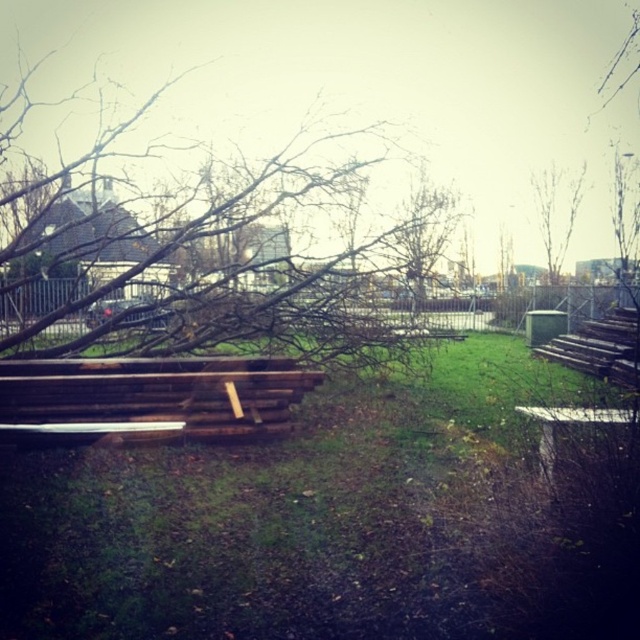
Question: Among these objects, which one is farthest from the camera?

Choices:
 (A) brown wooden bench at center
 (B) white wood park bench at lower right
 (C) brown wood tree at center

Answer: (C)

Question: Estimate the real-world distances between objects in this image. Which object is farther from the bare branches at upper right?

Choices:
 (A) brown wood tree at center
 (B) white wood park bench at lower right
 (C) brown wooden bench at center

Answer: (B)

Question: Can you confirm if bare branches at upper right is positioned to the right of white wood park bench at lower right?

Choices:
 (A) no
 (B) yes

Answer: (B)

Question: Can you confirm if brown wood tree at center is bigger than bare branches at upper right?

Choices:
 (A) no
 (B) yes

Answer: (B)

Question: Which of the following is the closest to the observer?

Choices:
 (A) (580, 188)
 (B) (580, 419)
 (C) (36, 362)

Answer: (B)

Question: Does brown wooden bench at center appear on the right side of white wood park bench at lower right?

Choices:
 (A) yes
 (B) no

Answer: (B)